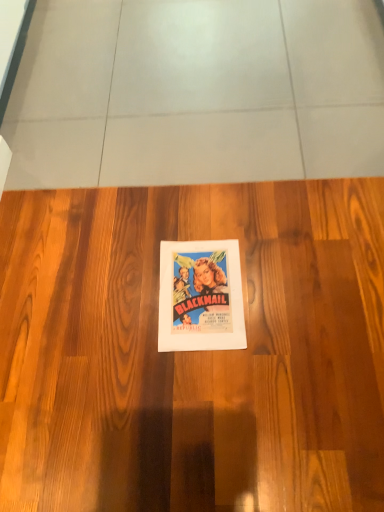
Describe the element at coordinates (200, 297) in the screenshot. I see `vibrant paper poster at center` at that location.

Image resolution: width=384 pixels, height=512 pixels. Identify the location of vibrant paper poster at center. (200, 297).

What is the approximate height of vibrant paper poster at center?

vibrant paper poster at center is 0.58 inches tall.

What is the approximate width of wooden floor at center?

It is 1.44 meters.

The image size is (384, 512). What do you see at coordinates (192, 352) in the screenshot? I see `wooden floor at center` at bounding box center [192, 352].

Where is `wooden floor at center`? The height and width of the screenshot is (512, 384). wooden floor at center is located at coordinates (192, 352).

Where is `vibrant paper poster at center`? Image resolution: width=384 pixels, height=512 pixels. vibrant paper poster at center is located at coordinates (200, 297).

Is wooden floor at center at the right side of vibrant paper poster at center?

Incorrect, wooden floor at center is not on the right side of vibrant paper poster at center.

Considering the relative positions of wooden floor at center and vibrant paper poster at center in the image provided, is wooden floor at center behind vibrant paper poster at center?

No, wooden floor at center is in front of vibrant paper poster at center.

Considering the points (81, 461) and (185, 296), which point is in front, point (81, 461) or point (185, 296)?

Point (81, 461)

Based on the photo, from the image's perspective, who appears lower, wooden floor at center or vibrant paper poster at center?

vibrant paper poster at center.

From a real-world perspective, between wooden floor at center and vibrant paper poster at center, who is vertically higher?

vibrant paper poster at center is physically above.

Which of these two, wooden floor at center or vibrant paper poster at center, is wider?

wooden floor at center is wider.

Can you confirm if wooden floor at center is shorter than vibrant paper poster at center?

No, wooden floor at center is not shorter than vibrant paper poster at center.

Can you confirm if wooden floor at center is smaller than vibrant paper poster at center?

No, wooden floor at center is not smaller than vibrant paper poster at center.

Does wooden floor at center contain vibrant paper poster at center?

Indeed, vibrant paper poster at center is located within wooden floor at center.

Does wooden floor at center touch vibrant paper poster at center?

There is a gap between wooden floor at center and vibrant paper poster at center.

Is wooden floor at center looking in the opposite direction of vibrant paper poster at center?

wooden floor at center does not have its back to vibrant paper poster at center.

Based on the photo, can you tell me how much wooden floor at center and vibrant paper poster at center differ in facing direction?

The angle between the facing direction of wooden floor at center and the facing direction of vibrant paper poster at center is 92.1 degrees.

Find the location of a particular element. The image size is (384, 512). poster located below the wooden floor at center (from the image's perspective) is located at coordinates (200, 297).

Considering the relative positions of vibrant paper poster at center and wooden floor at center in the image provided, is vibrant paper poster at center to the left or to the right of wooden floor at center?

Based on their positions, vibrant paper poster at center is located to the right of wooden floor at center.

Does vibrant paper poster at center come behind wooden floor at center?

Yes, vibrant paper poster at center is behind wooden floor at center.

Between point (226, 335) and point (93, 327), which one is positioned behind?

The point (93, 327) is farther from the camera.

From the image's perspective, which one is positioned lower, vibrant paper poster at center or wooden floor at center?

From the image's view, vibrant paper poster at center is below.

From a real-world perspective, which is physically below, vibrant paper poster at center or wooden floor at center?

wooden floor at center is physically lower.

Looking at this image, considering the sizes of objects vibrant paper poster at center and wooden floor at center in the image provided, who is thinner, vibrant paper poster at center or wooden floor at center?

vibrant paper poster at center.

In the scene shown: From their relative heights in the image, would you say vibrant paper poster at center is taller or shorter than wooden floor at center?

In the image, vibrant paper poster at center appears to be shorter than wooden floor at center.

Is vibrant paper poster at center smaller than wooden floor at center?

Yes.

Is wooden floor at center a part of vibrant paper poster at center?

No.

Would you consider vibrant paper poster at center to be distant from wooden floor at center?

No, vibrant paper poster at center is in close proximity to wooden floor at center.

Could you tell me if vibrant paper poster at center is facing wooden floor at center?

Yes, vibrant paper poster at center is aimed at wooden floor at center.

How many degrees apart are the facing directions of vibrant paper poster at center and wooden floor at center?

The angular difference between vibrant paper poster at center and wooden floor at center is 92.1 degrees.

This screenshot has width=384, height=512. In order to click on poster on the right side of wooden floor at center in this screenshot , I will do `click(200, 297)`.

You are a GUI agent. You are given a task and a screenshot of the screen. Output one action in this format:
    pyautogui.click(x=<x>, y=<y>)
    Task: Click on the hardwood lying above the vibrant paper poster at center (from the image's perspective)
    The width and height of the screenshot is (384, 512).
    Given the screenshot: What is the action you would take?
    pyautogui.click(x=192, y=352)

Where is `hardwood that appears below the vibrant paper poster at center (from a real-world perspective)`? hardwood that appears below the vibrant paper poster at center (from a real-world perspective) is located at coordinates (192, 352).